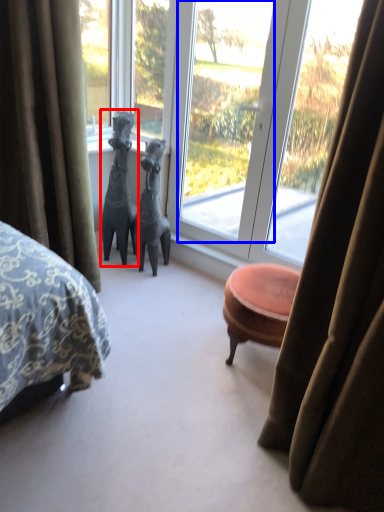
Question: Which of the following is the closest to the observer, animal (highlighted by a red box) or window screen (highlighted by a blue box)?

Choices:
 (A) animal
 (B) window screen

Answer: (B)